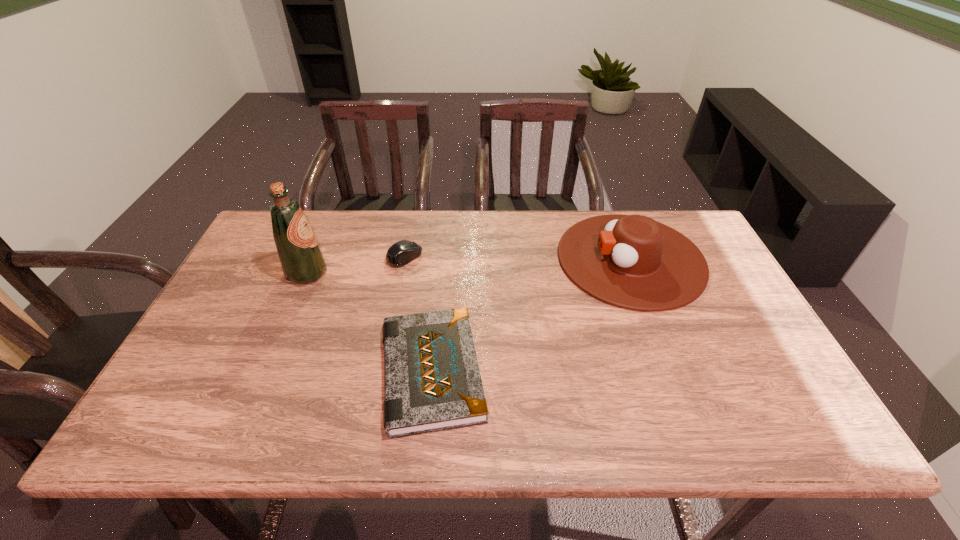
You are a GUI agent. You are given a task and a screenshot of the screen. Output one action in this format:
    pyautogui.click(x=<x>, y=<y>)
    Task: Click on the leftmost object
    The height and width of the screenshot is (540, 960).
    Given the screenshot: What is the action you would take?
    pyautogui.click(x=302, y=261)

Locate an element on the screen. olive oil is located at coordinates (302, 261).

I want to click on cowboy hat, so click(630, 261).

You are a GUI agent. You are given a task and a screenshot of the screen. Output one action in this format:
    pyautogui.click(x=<x>, y=<y>)
    Task: Click on the rightmost object
    This screenshot has height=540, width=960.
    Given the screenshot: What is the action you would take?
    pyautogui.click(x=630, y=261)

Locate an element on the screen. mouse is located at coordinates (401, 253).

Locate an element on the screen. The width and height of the screenshot is (960, 540). the nearest object is located at coordinates (432, 382).

Locate an element on the screen. free spot located on the front-facing side of the tallest object is located at coordinates (348, 273).

At what (x,y) coordinates should I click in order to perform the action: click on vacant region located on the front-facing side of the rightmost object. Please return your answer as a coordinate pair (x, y). This screenshot has width=960, height=540. Looking at the image, I should click on (425, 259).

This screenshot has width=960, height=540. What are the coordinates of `vacant space located on the front-facing side of the rightmost object` in the screenshot? It's located at (518, 259).

The image size is (960, 540). In order to click on vacant space located on the front-facing side of the rightmost object in this screenshot , I will do `click(468, 259)`.